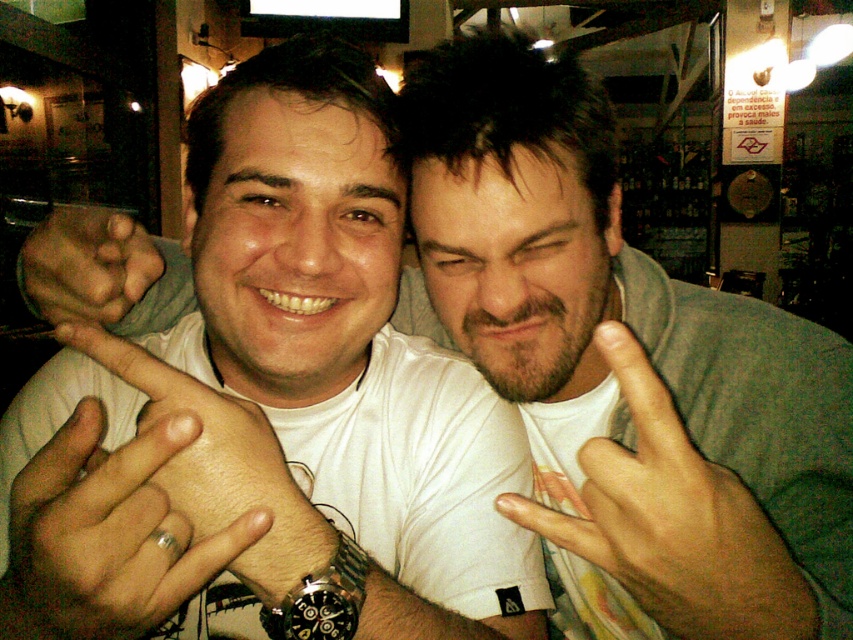
Consider the image. You are a photographer adjusting your camera settings to focus on the point at coordinates point (86, 264). Based on the scene description, what object or part of the scene is located at this point?

The point (86, 264) is located on the matte skin hand at center, which belongs to one of the individuals in the image.

You are a photographer trying to capture the scene in the image. You need to focus on the beige fabric hand at center. Where exactly should you point the camera to capture it?

You should point the camera at point coordinates (x=674, y=520) to capture the beige fabric hand at center.

You are a photographer trying to capture a closeup of both hands at the center of the image. Since the space between the two hands is limited, will the beige fabric hand at center and the matte skin hand at center fit comfortably in the frame?

The beige fabric hand at center occupies less space than matte skin hand at center, so both hands can fit comfortably in the frame since the beige fabric hand at center takes up less space.